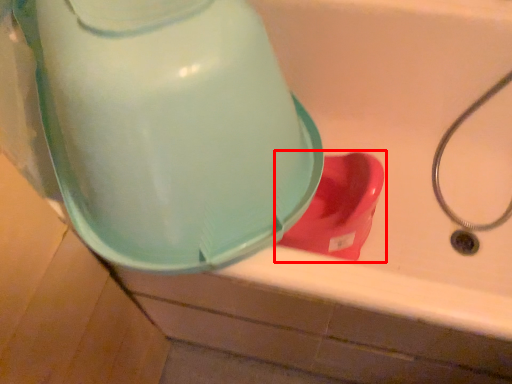
Question: From the image's perspective, what is the correct spatial positioning of toilet (annotated by the red box) in reference to water cooler?

Choices:
 (A) below
 (B) above

Answer: (A)